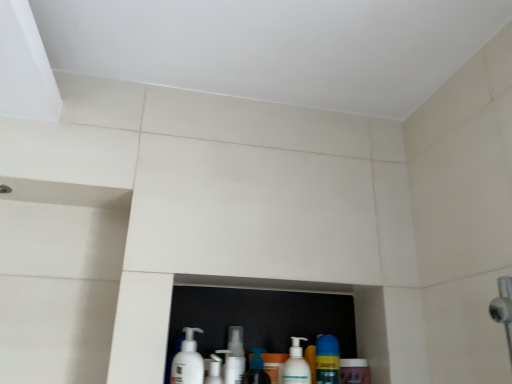
Question: From a real-world perspective, is yellow matte bottle at lower center, the first cleaning product from the right, physically below white plastic pump bottle at lower center, placed as the fourth cleaning product when sorted from left to right?

Choices:
 (A) yes
 (B) no

Answer: (B)

Question: Considering the relative positions of yellow matte bottle at lower center, the first cleaning product from the right, and white plastic pump bottle at lower center, placed as the fourth cleaning product when sorted from left to right, in the image provided, is yellow matte bottle at lower center, the first cleaning product from the right, to the right of white plastic pump bottle at lower center, placed as the fourth cleaning product when sorted from left to right, from the viewer's perspective?

Choices:
 (A) no
 (B) yes

Answer: (B)

Question: Is yellow matte bottle at lower center, the 5th cleaning product when ordered from left to right, further to the viewer compared to white plastic pump bottle at lower center, placed as the fourth cleaning product when sorted from left to right?

Choices:
 (A) no
 (B) yes

Answer: (B)

Question: Can you confirm if yellow matte bottle at lower center, the first cleaning product from the right, is wider than white plastic pump bottle at lower center, the 2th cleaning product viewed from the right?

Choices:
 (A) no
 (B) yes

Answer: (B)

Question: From a real-world perspective, is yellow matte bottle at lower center, the first cleaning product from the right, over white plastic pump bottle at lower center, placed as the fourth cleaning product when sorted from left to right?

Choices:
 (A) no
 (B) yes

Answer: (B)

Question: Considering the relative sizes of yellow matte bottle at lower center, the 5th cleaning product when ordered from left to right, and white plastic pump bottle at lower center, placed as the fourth cleaning product when sorted from left to right, in the image provided, is yellow matte bottle at lower center, the 5th cleaning product when ordered from left to right, shorter than white plastic pump bottle at lower center, placed as the fourth cleaning product when sorted from left to right,?

Choices:
 (A) no
 (B) yes

Answer: (B)

Question: Is the depth of white plastic cup at center, which is the 2th cleaning product in left-to-right order, less than that of white plastic pump bottle at lower center, the 2th cleaning product viewed from the right?

Choices:
 (A) no
 (B) yes

Answer: (A)

Question: Is white plastic cup at center, which is the 2th cleaning product in left-to-right order, taller than white plastic pump bottle at lower center, the 2th cleaning product viewed from the right?

Choices:
 (A) no
 (B) yes

Answer: (A)

Question: From a real-world perspective, does white plastic cup at center, the fourth cleaning product when ordered from right to left, sit lower than white plastic pump bottle at lower center, the 2th cleaning product viewed from the right?

Choices:
 (A) yes
 (B) no

Answer: (A)

Question: From a real-world perspective, is white plastic cup at center, which is the 2th cleaning product in left-to-right order, located higher than white plastic pump bottle at lower center, the 2th cleaning product viewed from the right?

Choices:
 (A) no
 (B) yes

Answer: (A)

Question: Is white plastic cup at center, the fourth cleaning product when ordered from right to left, at the left side of white plastic pump bottle at lower center, placed as the fourth cleaning product when sorted from left to right?

Choices:
 (A) no
 (B) yes

Answer: (B)

Question: Is white plastic cup at center, which is the 2th cleaning product in left-to-right order, located outside white plastic pump bottle at lower center, the 2th cleaning product viewed from the right?

Choices:
 (A) yes
 (B) no

Answer: (A)

Question: Can you confirm if translucent plastic soap dispenser at center, acting as the 3th cleaning product starting from the right, is wider than white matte pump bottle at lower center, the 1th cleaning product from the left?

Choices:
 (A) yes
 (B) no

Answer: (B)